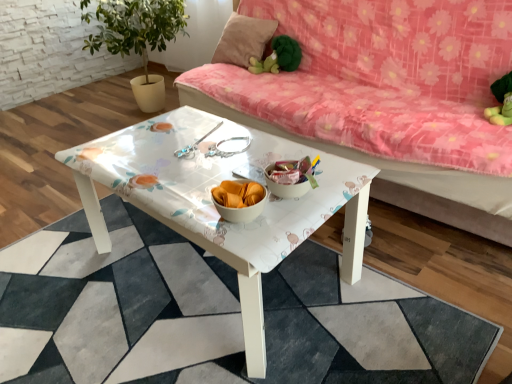
Locate an element on the screen. The width and height of the screenshot is (512, 384). vacant point above white glossy table at center (from a real-world perspective) is located at coordinates (194, 304).